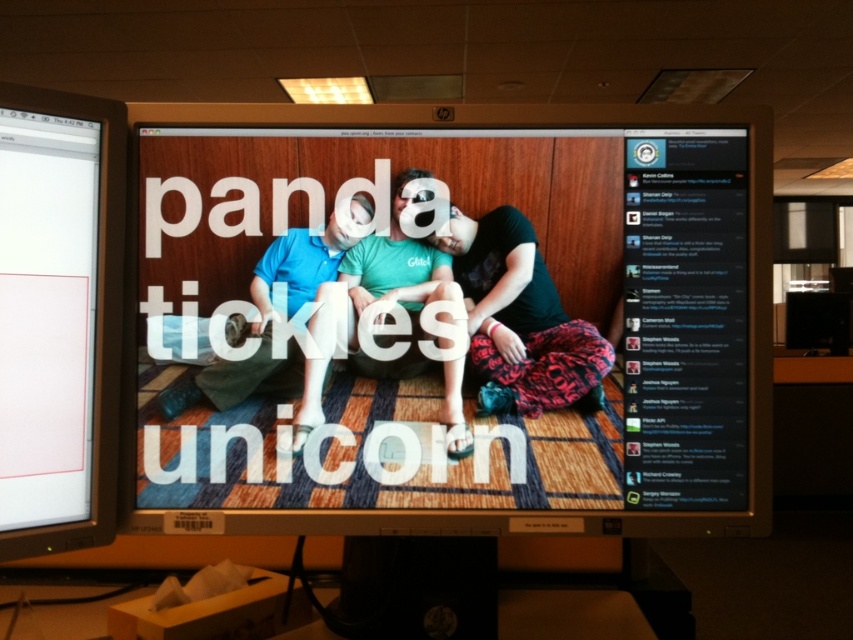
You are navigating a virtual 3D space where you can move freely. You see two points in the scene labeled as point (575, 280) and point (28, 125). Which point would you need to move closer to reach first if you are moving straight ahead?

Point (575, 280) is further to the viewer than point (28, 125), so you would reach point (28, 125) first as it is closer to your current position.